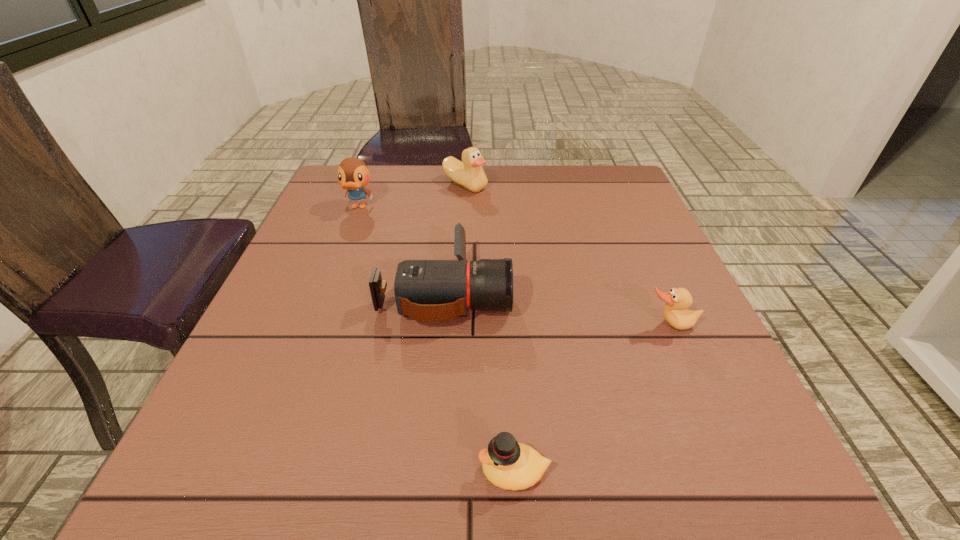
Locate an element on the screen. The image size is (960, 540). the third nearest duck is located at coordinates (353, 175).

In order to click on the leftmost duck in this screenshot , I will do `click(353, 175)`.

You are a GUI agent. You are given a task and a screenshot of the screen. Output one action in this format:
    pyautogui.click(x=<x>, y=<y>)
    Task: Click on the farthest duck
    
    Given the screenshot: What is the action you would take?
    pyautogui.click(x=469, y=174)

This screenshot has width=960, height=540. I want to click on camcorder, so click(x=425, y=290).

Where is `the rightmost duck`? the rightmost duck is located at coordinates (675, 312).

This screenshot has height=540, width=960. I want to click on the second nearest duck, so click(675, 312).

I want to click on the nearest duck, so click(507, 464).

Image resolution: width=960 pixels, height=540 pixels. In order to click on free space located 0.230m on the front-facing side of the fourth nearest object in this screenshot , I will do `click(332, 276)`.

You are a GUI agent. You are given a task and a screenshot of the screen. Output one action in this format:
    pyautogui.click(x=<x>, y=<y>)
    Task: Click on the free location located at the beak of the farthest duck
    The height and width of the screenshot is (540, 960).
    Given the screenshot: What is the action you would take?
    pyautogui.click(x=463, y=230)

You are a GUI agent. You are given a task and a screenshot of the screen. Output one action in this format:
    pyautogui.click(x=<x>, y=<y>)
    Task: Click on the free space located 0.060m on the lens of the camcorder
    This screenshot has height=540, width=960.
    Given the screenshot: What is the action you would take?
    pyautogui.click(x=538, y=291)